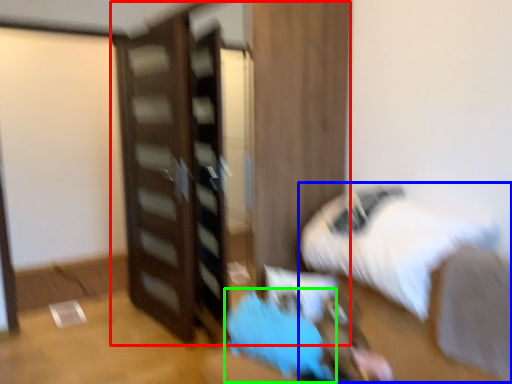
Question: Considering the real-world distances, which object is farthest from dresser (highlighted by a red box)? bed (highlighted by a blue box) or bean bag chair (highlighted by a green box)?

Choices:
 (A) bed
 (B) bean bag chair

Answer: (A)